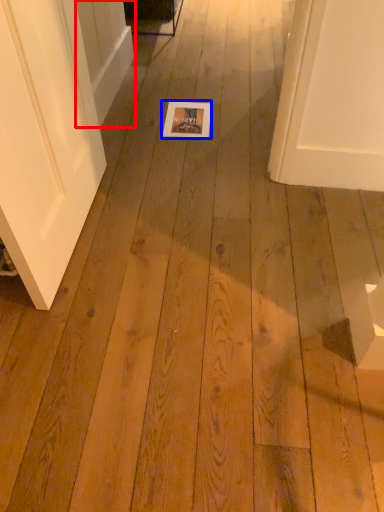
Question: Among these objects, which one is farthest to the camera, screen door (highlighted by a red box) or postcard (highlighted by a blue box)?

Choices:
 (A) screen door
 (B) postcard

Answer: (B)